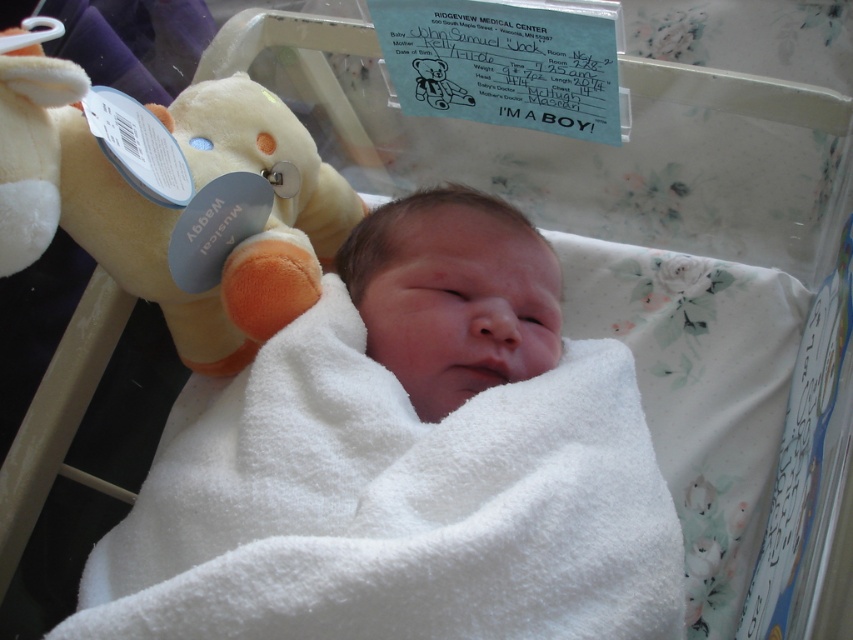
Question: Which point is closer to the camera?

Choices:
 (A) (291, 300)
 (B) (469, 292)

Answer: (B)

Question: Does fluffy white plush bear at left appear under white soft blanket at center?

Choices:
 (A) yes
 (B) no

Answer: (B)

Question: Is fluffy white plush bear at left wider than white soft blanket at center?

Choices:
 (A) yes
 (B) no

Answer: (A)

Question: Which object is farther from the camera taking this photo?

Choices:
 (A) fluffy white plush bear at left
 (B) white soft blanket at center

Answer: (B)

Question: Which point is closer to the camera taking this photo?

Choices:
 (A) (554, 336)
 (B) (286, 236)

Answer: (A)

Question: Can you confirm if fluffy white plush bear at left is wider than white soft blanket at center?

Choices:
 (A) no
 (B) yes

Answer: (B)